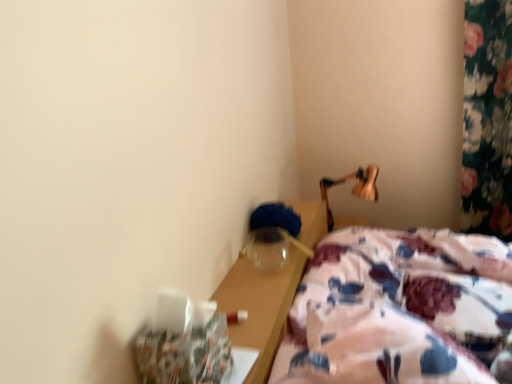
Question: Relative to wooden lamp at upper right, is floral fabric bed at lower right in front or behind?

Choices:
 (A) behind
 (B) front

Answer: (B)

Question: Would you say floral fabric bed at lower right is inside or outside wooden lamp at upper right?

Choices:
 (A) inside
 (B) outside

Answer: (B)

Question: From the image's perspective, is floral fabric bed at lower right located above or below wooden lamp at upper right?

Choices:
 (A) below
 (B) above

Answer: (A)

Question: Is point (354, 173) closer or farther from the camera than point (338, 342)?

Choices:
 (A) closer
 (B) farther

Answer: (B)

Question: From the image's perspective, relative to floral fabric bed at lower right, is wooden lamp at upper right above or below?

Choices:
 (A) above
 (B) below

Answer: (A)

Question: Is wooden lamp at upper right taller or shorter than floral fabric bed at lower right?

Choices:
 (A) short
 (B) tall

Answer: (A)

Question: Is wooden lamp at upper right in front of or behind floral fabric bed at lower right in the image?

Choices:
 (A) behind
 (B) front

Answer: (A)